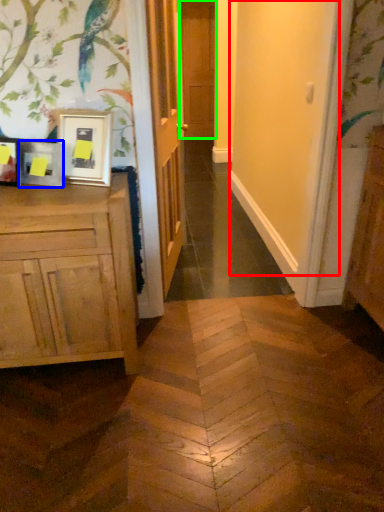
Question: Based on their relative distances, which object is farther from screen door (highlighted by a red box)? Choose from picture frame (highlighted by a blue box) and door (highlighted by a green box).

Choices:
 (A) picture frame
 (B) door

Answer: (B)